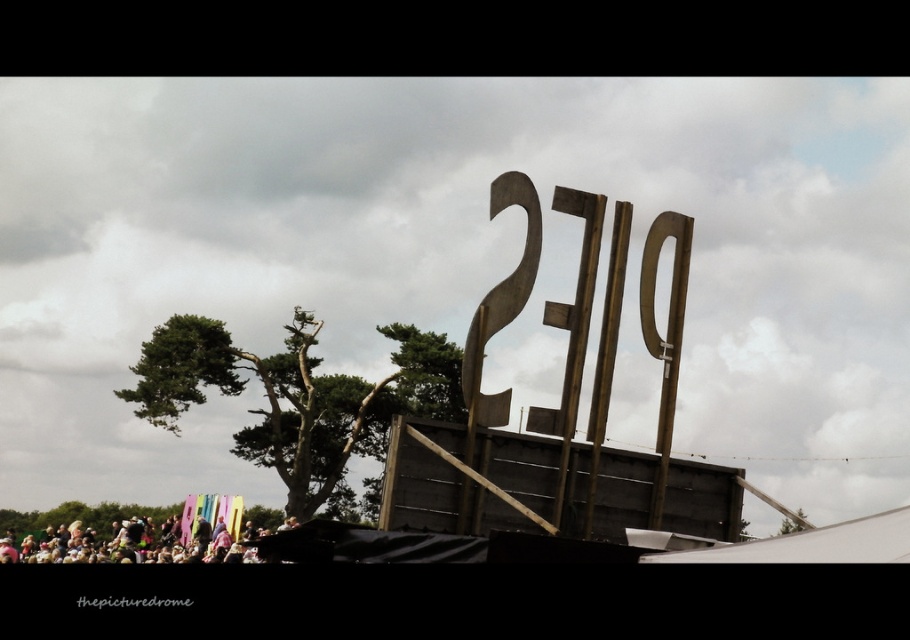
You are standing at the point closest to the viewer in the image. Which of the two points, point (372, 432) or point (4, 524), is farther away from you?

Point (372, 432) is behind point (4, 524), so it is farther away from you.

You are standing in the outdoor scene described. There is a point located at coordinates (297,397). What object is this point located on?

The point at coordinates (297,397) is located on the green textured tree at center.

You are standing at the multicolored fabric at lower left and want to walk towards the green textured tree at center. Which direction should you move?

You should move to your right since the green textured tree at center is located to the right of the multicolored fabric at lower left.